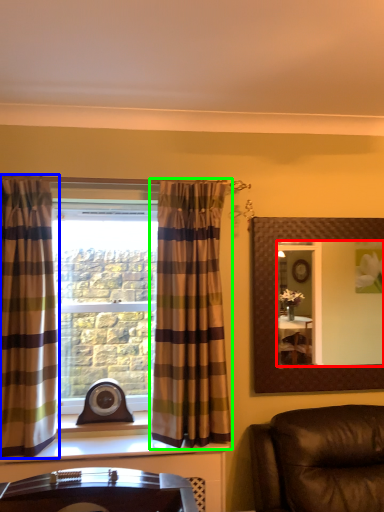
Question: Which is nearer to the mirror (highlighted by a red box)? curtain (highlighted by a blue box) or curtain (highlighted by a green box).

Choices:
 (A) curtain
 (B) curtain

Answer: (B)